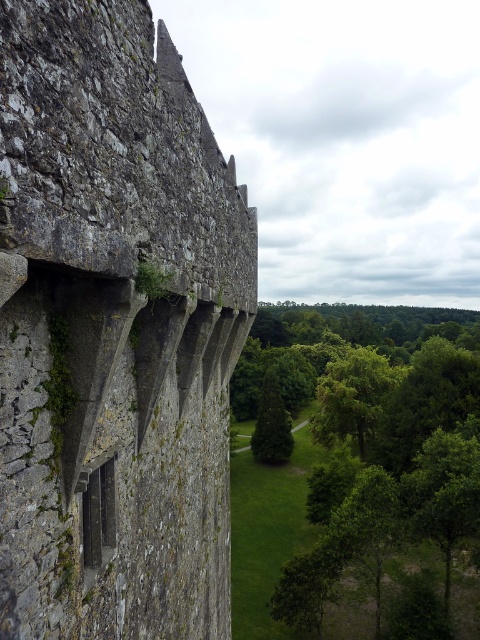
Question: Which of the following is the farthest from the observer?

Choices:
 (A) (262, 477)
 (B) (79, 596)

Answer: (A)

Question: Is rough stone wall at left wider than green leafy tree at center?

Choices:
 (A) yes
 (B) no

Answer: (B)

Question: Which object appears farthest from the camera in this image?

Choices:
 (A) green leafy tree at center
 (B) rough stone wall at left

Answer: (A)

Question: Which object appears closest to the camera in this image?

Choices:
 (A) green leafy tree at center
 (B) rough stone wall at left

Answer: (B)

Question: Can you confirm if rough stone wall at left is wider than green leafy tree at center?

Choices:
 (A) no
 (B) yes

Answer: (A)

Question: Does rough stone wall at left appear on the left side of green leafy tree at center?

Choices:
 (A) yes
 (B) no

Answer: (A)